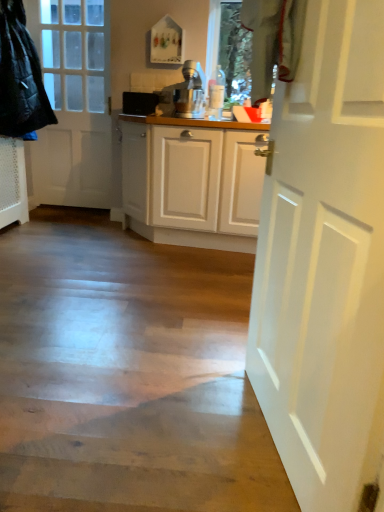
Measure the distance between white matte door at left, the first door viewed from the left, and camera.

white matte door at left, the first door viewed from the left, is 3.50 meters away from camera.

Measure the distance between point (40, 5) and camera.

Point (40, 5) is 3.52 meters from camera.

The image size is (384, 512). What do you see at coordinates (20, 77) in the screenshot?
I see `quilted black jacket at left` at bounding box center [20, 77].

At what (x,y) coordinates should I click in order to perform the action: click on white matte door at left, the second door ordered from the bottom. Please return your answer as a coordinate pair (x, y). The height and width of the screenshot is (512, 384). Looking at the image, I should click on (72, 103).

Could you tell me if quilted black jacket at left is facing white matte door at right, the first door in the front-to-back sequence?

No.

Can you confirm if quilted black jacket at left is positioned to the right of white matte door at right, which appears as the 1th door when viewed from the right?

In fact, quilted black jacket at left is to the left of white matte door at right, which appears as the 1th door when viewed from the right.

This screenshot has width=384, height=512. Identify the location of jacket that appears on the left of white matte door at right, the first door when ordered from bottom to top. (20, 77).

Would you say quilted black jacket at left is inside or outside white matte door at right, which appears as the 1th door when viewed from the right?

The correct answer is: outside.

Is white matte door at right, the second door viewed from the left, far from white matte door at left, the first door in the top-to-bottom sequence?

white matte door at right, the second door viewed from the left, is positioned a significant distance from white matte door at left, the first door in the top-to-bottom sequence.

Which object is positioned more to the left, white matte door at right, the 2th door positioned from the top, or white matte door at left, the first door viewed from the left?

white matte door at left, the first door viewed from the left, is more to the left.

Image resolution: width=384 pixels, height=512 pixels. What are the coordinates of `door on the left side of white matte door at right, the first door when ordered from bottom to top` in the screenshot? It's located at (72, 103).

Which of these two, white matte door at right, the second door viewed from the left, or white matte door at left, the first door viewed from the left, stands shorter?

With less height is white matte door at right, the second door viewed from the left.

From a real-world perspective, is black plastic speaker at center positioned above or below quilted black jacket at left?

From a real-world perspective, black plastic speaker at center is physically below quilted black jacket at left.

Is the surface of black plastic speaker at center in direct contact with quilted black jacket at left?

black plastic speaker at center and quilted black jacket at left are clearly separated.

From the image's perspective, is black plastic speaker at center located beneath quilted black jacket at left?

Yes, from the image's perspective, black plastic speaker at center is below quilted black jacket at left.

Between black plastic speaker at center and quilted black jacket at left, which one appears on the right side from the viewer's perspective?

Positioned to the right is black plastic speaker at center.

Consider the image. Can you confirm if white matte door at left, the first door viewed from the left, is positioned to the left of quilted black jacket at left?

Incorrect, white matte door at left, the first door viewed from the left, is not on the left side of quilted black jacket at left.

Is white matte door at left, the first door viewed from the left, placed right next to quilted black jacket at left?

No, white matte door at left, the first door viewed from the left, is not touching quilted black jacket at left.

From the image's perspective, who appears lower, white matte door at left, the first door in the top-to-bottom sequence, or quilted black jacket at left?

white matte door at left, the first door in the top-to-bottom sequence, appears lower in the image.

Considering the points (81, 187) and (35, 58), which point is in front, point (81, 187) or point (35, 58)?

The point (35, 58) is closer.

Considering the relative sizes of white matte door at right, the 2th door positioned from the top, and quilted black jacket at left in the image provided, is white matte door at right, the 2th door positioned from the top, smaller than quilted black jacket at left?

Yes, white matte door at right, the 2th door positioned from the top, is smaller than quilted black jacket at left.

Based on the photo, which of these two, white matte door at right, which appears as the 1th door when viewed from the right, or quilted black jacket at left, is thinner?

Thinner between the two is white matte door at right, which appears as the 1th door when viewed from the right.

Is white matte door at right, which appears as the 1th door when viewed from the right, inside or outside of quilted black jacket at left?

The correct answer is: outside.

Based on their positions, is white matte door at right, the second door viewed from the left, located to the left or right of quilted black jacket at left?

white matte door at right, the second door viewed from the left, is positioned on quilted black jacket at left's right side.

From the image's perspective, between black plastic speaker at center and white matte door at left, the second door ordered from the bottom, who is located below?

black plastic speaker at center is shown below in the image.

Is black plastic speaker at center turned away from white matte door at left, the second door ordered from the bottom?

Result: No.

Which of these two, black plastic speaker at center or white matte door at left, which is counted as the second door, starting from the front, stands shorter?

black plastic speaker at center is shorter.

Between white matte door at right, the first door when ordered from bottom to top, and black plastic speaker at center, which one is positioned behind?

black plastic speaker at center is behind.

Which is more to the left, white matte door at right, which appears as the 1th door when viewed from the right, or black plastic speaker at center?

black plastic speaker at center is more to the left.

From a real-world perspective, does white matte door at right, the first door in the front-to-back sequence, sit lower than black plastic speaker at center?

Indeed, from a real-world perspective, white matte door at right, the first door in the front-to-back sequence, is positioned beneath black plastic speaker at center.

Is white matte door at right, which is the second door from back to front, spatially inside black plastic speaker at center, or outside of it?

The correct answer is: outside.

Where is `door in front of the quilted black jacket at left`? door in front of the quilted black jacket at left is located at coordinates (325, 261).

Where is `door on the right of white matte door at left, the first door when ordered from back to front`? The width and height of the screenshot is (384, 512). door on the right of white matte door at left, the first door when ordered from back to front is located at coordinates coord(325,261).

From the image, which object appears to be farther from white matte door at left, the first door when ordered from back to front, white matte door at right, the 2th door positioned from the top, or quilted black jacket at left?

Based on the image, white matte door at right, the 2th door positioned from the top, appears to be further to white matte door at left, the first door when ordered from back to front.

Based on their spatial positions, is quilted black jacket at left or black plastic speaker at center closer to white matte door at right, the second door viewed from the left?

Among the two, quilted black jacket at left is located nearer to white matte door at right, the second door viewed from the left.

Looking at the image, which one is located further to white matte door at left, the first door viewed from the left, white matte door at right, the first door when ordered from bottom to top, or black plastic speaker at center?

Based on the image, white matte door at right, the first door when ordered from bottom to top, appears to be further to white matte door at left, the first door viewed from the left.

From the image, which object appears to be farther from black plastic speaker at center, white matte door at left, the first door when ordered from back to front, or quilted black jacket at left?

white matte door at left, the first door when ordered from back to front, lies further to black plastic speaker at center than the other object.

Based on their spatial positions, is quilted black jacket at left or white matte door at left, which is counted as the second door, starting from the front, closer to black plastic speaker at center?

Based on the image, quilted black jacket at left appears to be nearer to black plastic speaker at center.

Based on their spatial positions, is white matte door at right, which appears as the 1th door when viewed from the right, or white matte door at left, the second door ordered from the bottom, further from black plastic speaker at center?

Among the two, white matte door at right, which appears as the 1th door when viewed from the right, is located further to black plastic speaker at center.

Estimate the real-world distances between objects in this image. Which object is further from white matte door at right, the 2th door positioned from the top, white matte door at left, the first door in the top-to-bottom sequence, or quilted black jacket at left?

Based on the image, white matte door at left, the first door in the top-to-bottom sequence, appears to be further to white matte door at right, the 2th door positioned from the top.

Based on their spatial positions, is quilted black jacket at left or white matte door at right, the first door in the front-to-back sequence, closer to black plastic speaker at center?

The object closer to black plastic speaker at center is quilted black jacket at left.

Identify the location of appliance located between white matte door at right, the second door viewed from the left, and white matte door at left, the first door in the top-to-bottom sequence, in the depth direction. This screenshot has width=384, height=512. (139, 103).

This screenshot has height=512, width=384. Identify the location of appliance positioned between quilted black jacket at left and white matte door at left, the first door in the top-to-bottom sequence, from near to far. (139, 103).

I want to click on jacket located between white matte door at right, the first door in the front-to-back sequence, and white matte door at left, placed as the second door when sorted from right to left, in the depth direction, so click(x=20, y=77).

At what (x,y) coordinates should I click in order to perform the action: click on jacket between white matte door at right, the first door in the front-to-back sequence, and black plastic speaker at center from front to back. Please return your answer as a coordinate pair (x, y). The width and height of the screenshot is (384, 512). Looking at the image, I should click on (20, 77).